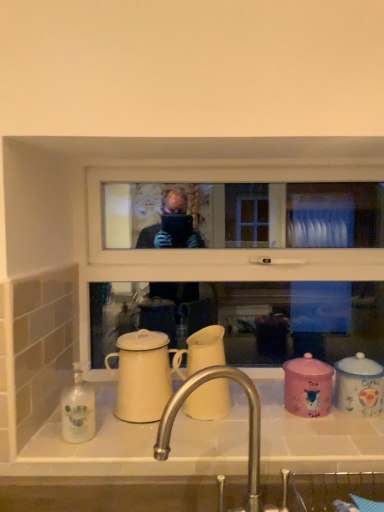
Measure the distance between matte white mug at center, the 1th coffee cup in the left-to-right sequence, and camera.

matte white mug at center, the 1th coffee cup in the left-to-right sequence, is 3.37 feet from camera.

Image resolution: width=384 pixels, height=512 pixels. Describe the element at coordinates (142, 375) in the screenshot. I see `matte white mug at center, which ranks as the fourth coffee cup in right-to-left order` at that location.

What do you see at coordinates (249, 422) in the screenshot? The height and width of the screenshot is (512, 384). I see `satin nickel faucet at center` at bounding box center [249, 422].

How much space does blue glossy coffee cup at right, which is counted as the 1th coffee cup, starting from the right, occupy vertically?

The height of blue glossy coffee cup at right, which is counted as the 1th coffee cup, starting from the right, is 6.09 inches.

The width and height of the screenshot is (384, 512). What are the coordinates of `white glossy sink at lower center` in the screenshot? It's located at (132, 466).

Can you confirm if blue glossy coffee cup at right, which is counted as the 1th coffee cup, starting from the right, is smaller than white glossy bottle at lower left?

Yes.

From the image's perspective, would you say blue glossy coffee cup at right, which is counted as the 1th coffee cup, starting from the right, is positioned over white glossy bottle at lower left?

Indeed, from the image's perspective, blue glossy coffee cup at right, which is counted as the 1th coffee cup, starting from the right, is shown above white glossy bottle at lower left.

Does blue glossy coffee cup at right, positioned as the 4th coffee cup in left-to-right order, appear on the left side of white glossy bottle at lower left?

No.

Considering the points (371, 370) and (80, 369), which point is in front, point (371, 370) or point (80, 369)?

The point (371, 370) is in front.

From a real-world perspective, is pink ceramic jar at lower right, the second coffee cup viewed from the right, under matte white mug at center, the 1th coffee cup in the left-to-right sequence?

Yes, from a real-world perspective, pink ceramic jar at lower right, the second coffee cup viewed from the right, is under matte white mug at center, the 1th coffee cup in the left-to-right sequence.

Between pink ceramic jar at lower right, the second coffee cup viewed from the right, and matte white mug at center, the 1th coffee cup in the left-to-right sequence, which one has smaller size?

With smaller size is pink ceramic jar at lower right, the second coffee cup viewed from the right.

Is pink ceramic jar at lower right, which appears as the 3th coffee cup when viewed from the left, oriented away from matte white mug at center, which ranks as the fourth coffee cup in right-to-left order?

No, matte white mug at center, which ranks as the fourth coffee cup in right-to-left order, is not at the back of pink ceramic jar at lower right, which appears as the 3th coffee cup when viewed from the left.

Is satin nickel faucet at center shorter than matte white mug at center, the 1th coffee cup in the left-to-right sequence?

In fact, satin nickel faucet at center may be taller than matte white mug at center, the 1th coffee cup in the left-to-right sequence.

From the picture: From the image's perspective, which is above, satin nickel faucet at center or matte white mug at center, the 1th coffee cup in the left-to-right sequence?

matte white mug at center, the 1th coffee cup in the left-to-right sequence, from the image's perspective.

Considering the relative sizes of satin nickel faucet at center and matte white mug at center, which ranks as the fourth coffee cup in right-to-left order, in the image provided, is satin nickel faucet at center thinner than matte white mug at center, which ranks as the fourth coffee cup in right-to-left order,?

No, satin nickel faucet at center is not thinner than matte white mug at center, which ranks as the fourth coffee cup in right-to-left order.

Consider the image. Is satin nickel faucet at center not within matte white mug at center, the 1th coffee cup in the left-to-right sequence?

Absolutely, satin nickel faucet at center is external to matte white mug at center, the 1th coffee cup in the left-to-right sequence.

Is pink ceramic jar at lower right, which appears as the 3th coffee cup when viewed from the left, positioned with its back to white glossy sink at lower center?

No, white glossy sink at lower center is not at the back of pink ceramic jar at lower right, which appears as the 3th coffee cup when viewed from the left.

Between pink ceramic jar at lower right, the second coffee cup viewed from the right, and white glossy sink at lower center, which one appears on the left side from the viewer's perspective?

white glossy sink at lower center.

From the image's perspective, does pink ceramic jar at lower right, the second coffee cup viewed from the right, appear higher than white glossy sink at lower center?

Yes, from the image's perspective, pink ceramic jar at lower right, the second coffee cup viewed from the right, is on top of white glossy sink at lower center.

Is pink ceramic jar at lower right, the second coffee cup viewed from the right, positioned behind white glossy sink at lower center?

Yes.

From the image's perspective, which one is positioned higher, white matte coffee cup at center, the third coffee cup when ordered from right to left, or white glossy sink at lower center?

white matte coffee cup at center, the third coffee cup when ordered from right to left, appears higher in the image.

From a real-world perspective, which is physically above, white matte coffee cup at center, the second coffee cup in the left-to-right sequence, or white glossy sink at lower center?

white matte coffee cup at center, the second coffee cup in the left-to-right sequence, is physically above.

Considering the sizes of white matte coffee cup at center, the second coffee cup in the left-to-right sequence, and white glossy sink at lower center in the image, is white matte coffee cup at center, the second coffee cup in the left-to-right sequence, taller or shorter than white glossy sink at lower center?

white matte coffee cup at center, the second coffee cup in the left-to-right sequence, is taller than white glossy sink at lower center.

Who is smaller, white matte coffee cup at center, the second coffee cup in the left-to-right sequence, or white glossy sink at lower center?

white matte coffee cup at center, the second coffee cup in the left-to-right sequence, is smaller.

From the picture: Which of these two, matte white mug at center, the 1th coffee cup in the left-to-right sequence, or white glossy bottle at lower left, is thinner?

white glossy bottle at lower left is thinner.

Considering the positions of objects matte white mug at center, the 1th coffee cup in the left-to-right sequence, and white glossy bottle at lower left in the image provided, who is in front, matte white mug at center, the 1th coffee cup in the left-to-right sequence, or white glossy bottle at lower left?

Positioned in front is white glossy bottle at lower left.

Could you tell me if matte white mug at center, the 1th coffee cup in the left-to-right sequence, is facing white glossy bottle at lower left?

No, matte white mug at center, the 1th coffee cup in the left-to-right sequence, does not turn towards white glossy bottle at lower left.

How many degrees apart are the facing directions of white plastic window frame at upper center and white matte coffee cup at center, the third coffee cup when ordered from right to left?

The angular difference between white plastic window frame at upper center and white matte coffee cup at center, the third coffee cup when ordered from right to left, is 1.93 degrees.

Based on the photo, is white plastic window frame at upper center oriented away from white matte coffee cup at center, the third coffee cup when ordered from right to left?

That's right, white plastic window frame at upper center is facing away from white matte coffee cup at center, the third coffee cup when ordered from right to left.

Does white plastic window frame at upper center touch white matte coffee cup at center, the second coffee cup in the left-to-right sequence?

No, white plastic window frame at upper center is not in contact with white matte coffee cup at center, the second coffee cup in the left-to-right sequence.

Which is in front, white plastic window frame at upper center or white matte coffee cup at center, the second coffee cup in the left-to-right sequence?

white matte coffee cup at center, the second coffee cup in the left-to-right sequence.

Identify the location of the 2nd coffee cup located beneath the white glossy bottle at lower left (from a real-world perspective). This screenshot has width=384, height=512. (359, 385).

Locate an element on the screen. the 1st coffee cup positioned below the matte white mug at center, the 1th coffee cup in the left-to-right sequence (from the image's perspective) is located at coordinates (307, 386).

When comparing their distances from white matte coffee cup at center, the second coffee cup in the left-to-right sequence, does blue glossy coffee cup at right, which is counted as the 1th coffee cup, starting from the right, or pink ceramic jar at lower right, the second coffee cup viewed from the right, seem closer?

Based on the image, pink ceramic jar at lower right, the second coffee cup viewed from the right, appears to be nearer to white matte coffee cup at center, the second coffee cup in the left-to-right sequence.

From the image, which object appears to be farther from pink ceramic jar at lower right, which appears as the 3th coffee cup when viewed from the left, white glossy sink at lower center or white glossy bottle at lower left?

white glossy bottle at lower left.

Estimate the real-world distances between objects in this image. Which object is further from white glossy sink at lower center, satin nickel faucet at center or white glossy bottle at lower left?

white glossy bottle at lower left.

Based on their spatial positions, is white plastic window frame at upper center or satin nickel faucet at center further from white glossy bottle at lower left?

Among the two, white plastic window frame at upper center is located further to white glossy bottle at lower left.

Which object lies further to the anchor point satin nickel faucet at center, white glossy sink at lower center or white plastic window frame at upper center?

white plastic window frame at upper center is further to satin nickel faucet at center.

In the scene shown: When comparing their distances from matte white mug at center, which ranks as the fourth coffee cup in right-to-left order, does blue glossy coffee cup at right, positioned as the 4th coffee cup in left-to-right order, or white glossy sink at lower center seem further?

blue glossy coffee cup at right, positioned as the 4th coffee cup in left-to-right order, is further to matte white mug at center, which ranks as the fourth coffee cup in right-to-left order.

Estimate the real-world distances between objects in this image. Which object is closer to white matte coffee cup at center, the third coffee cup when ordered from right to left, white glossy sink at lower center or white plastic window frame at upper center?

white glossy sink at lower center is positioned closer to the anchor white matte coffee cup at center, the third coffee cup when ordered from right to left.

Estimate the real-world distances between objects in this image. Which object is further from satin nickel faucet at center, pink ceramic jar at lower right, the second coffee cup viewed from the right, or blue glossy coffee cup at right, which is counted as the 1th coffee cup, starting from the right?

blue glossy coffee cup at right, which is counted as the 1th coffee cup, starting from the right, is further to satin nickel faucet at center.

Where is `tap between white glossy bottle at lower left and pink ceramic jar at lower right, the second coffee cup viewed from the right`? tap between white glossy bottle at lower left and pink ceramic jar at lower right, the second coffee cup viewed from the right is located at coordinates coord(249,422).

Where is `sink situated between matte white mug at center, the 1th coffee cup in the left-to-right sequence, and pink ceramic jar at lower right, the second coffee cup viewed from the right, from left to right`? sink situated between matte white mug at center, the 1th coffee cup in the left-to-right sequence, and pink ceramic jar at lower right, the second coffee cup viewed from the right, from left to right is located at coordinates (132, 466).

Locate an element on the screen. window frame located between white matte coffee cup at center, the second coffee cup in the left-to-right sequence, and blue glossy coffee cup at right, which is counted as the 1th coffee cup, starting from the right, in the left-right direction is located at coordinates (240, 260).

Locate an element on the screen. The image size is (384, 512). window frame between matte white mug at center, the 1th coffee cup in the left-to-right sequence, and pink ceramic jar at lower right, which appears as the 3th coffee cup when viewed from the left, from left to right is located at coordinates (240, 260).